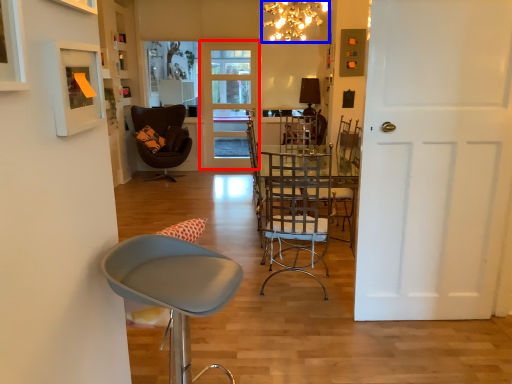
Question: Which of the following is the farthest to the observer, door (highlighted by a red box) or lamp (highlighted by a blue box)?

Choices:
 (A) door
 (B) lamp

Answer: (A)